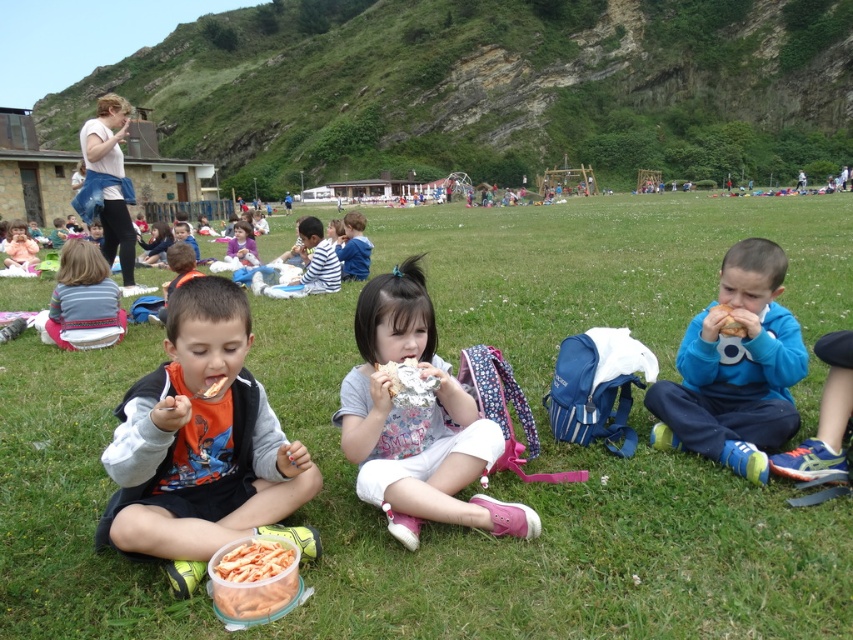
Does point (724, 323) come behind point (721, 328)?

No, it is in front of (721, 328).

Is brown bread at center above smooth brown bread at center?

Indeed, brown bread at center is positioned over smooth brown bread at center.

Image resolution: width=853 pixels, height=640 pixels. What do you see at coordinates (729, 323) in the screenshot?
I see `brown bread at center` at bounding box center [729, 323].

Identify the location of brown bread at center. (729, 323).

Which is more to the left, pink fabric backpack at center or brown bread at center?

pink fabric backpack at center

Which is above, pink fabric backpack at center or brown bread at center?

brown bread at center

Who is more distant from viewer, (392, 337) or (726, 307)?

The point (726, 307) is more distant.

Find the location of a particular element. The width and height of the screenshot is (853, 640). pink fabric backpack at center is located at coordinates (416, 420).

Who is taller, pink fabric backpack at center or smooth brown bread at center?

Standing taller between the two is pink fabric backpack at center.

Is pink fabric backpack at center to the right of smooth brown bread at center from the viewer's perspective?

Incorrect, pink fabric backpack at center is not on the right side of smooth brown bread at center.

In order to click on pink fabric backpack at center in this screenshot , I will do `click(416, 420)`.